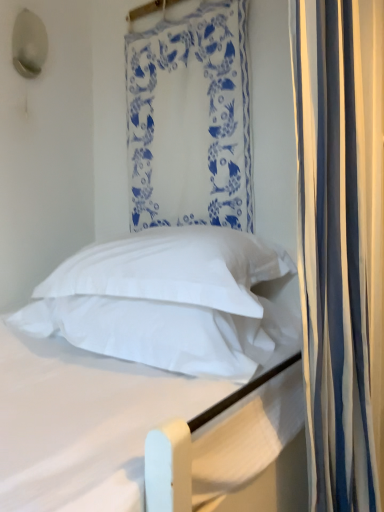
Measure the distance between point (150, 164) and camera.

Point (150, 164) is 4.96 feet away from camera.

In the scene shown: Measure the distance between point [133,255] and camera.

Point [133,255] is 3.72 feet from camera.

Image resolution: width=384 pixels, height=512 pixels. Find the location of `white soft pillow at center, which appears as the 1th pillow when ordered from the bottom`. white soft pillow at center, which appears as the 1th pillow when ordered from the bottom is located at coordinates (153, 333).

What are the coordinates of `white fabric at upper center, positioned as the 1th curtain in left-to-right order` in the screenshot? It's located at (190, 120).

From a real-world perspective, is white soft pillow at center, which is counted as the second pillow, starting from the bottom, located beneath white fabric at upper center, placed as the 1th curtain when sorted from back to front?

Correct, in the physical world, white soft pillow at center, which is counted as the second pillow, starting from the bottom, is lower than white fabric at upper center, placed as the 1th curtain when sorted from back to front.

Considering the relative sizes of white soft pillow at center, which is counted as the second pillow, starting from the bottom, and white fabric at upper center, placed as the 1th curtain when sorted from back to front, in the image provided, is white soft pillow at center, which is counted as the second pillow, starting from the bottom, smaller than white fabric at upper center, placed as the 1th curtain when sorted from back to front,?

Actually, white soft pillow at center, which is counted as the second pillow, starting from the bottom, might be larger than white fabric at upper center, placed as the 1th curtain when sorted from back to front.

From the image's perspective, is white soft pillow at center, which is counted as the second pillow, starting from the bottom, beneath white fabric at upper center, the 2th curtain in the front-to-back sequence?

Yes, from the image's perspective, white soft pillow at center, which is counted as the second pillow, starting from the bottom, is beneath white fabric at upper center, the 2th curtain in the front-to-back sequence.

How far apart are white striped curtain at right, which is counted as the 2th curtain, starting from the back, and white soft pillow at center, the 1th pillow in the top-to-bottom sequence?

15.44 inches.

Considering the relative sizes of white striped curtain at right, placed as the first curtain when sorted from front to back, and white soft pillow at center, the 1th pillow in the top-to-bottom sequence, in the image provided, is white striped curtain at right, placed as the first curtain when sorted from front to back, wider than white soft pillow at center, the 1th pillow in the top-to-bottom sequence,?

No, white striped curtain at right, placed as the first curtain when sorted from front to back, is not wider than white soft pillow at center, the 1th pillow in the top-to-bottom sequence.

Is white striped curtain at right, marked as the second curtain in a left-to-right arrangement, bigger or smaller than white soft pillow at center, the 1th pillow in the top-to-bottom sequence?

Considering their sizes, white striped curtain at right, marked as the second curtain in a left-to-right arrangement, takes up more space than white soft pillow at center, the 1th pillow in the top-to-bottom sequence.

Is white striped curtain at right, which is counted as the 2th curtain, starting from the back, aimed at white soft bed at center?

No.

Is white striped curtain at right, which is the first curtain in right-to-left order, bigger than white soft bed at center?

No, white striped curtain at right, which is the first curtain in right-to-left order, is not bigger than white soft bed at center.

Is white striped curtain at right, marked as the second curtain in a left-to-right arrangement, in contact with white soft bed at center?

white striped curtain at right, marked as the second curtain in a left-to-right arrangement, and white soft bed at center are clearly separated.

Between point (319, 316) and point (94, 419), which one is positioned in front?

The point (94, 419) is more forward.

Is point (289, 34) farther from camera compared to point (158, 310)?

No, it is in front of (158, 310).

Is white striped curtain at right, which is the first curtain in right-to-left order, looking in the opposite direction of white soft pillow at center, which is the second pillow in top-to-bottom order?

That's right, white striped curtain at right, which is the first curtain in right-to-left order, is facing away from white soft pillow at center, which is the second pillow in top-to-bottom order.

Considering the sizes of white striped curtain at right, which is the first curtain in right-to-left order, and white soft pillow at center, which is the second pillow in top-to-bottom order, in the image, is white striped curtain at right, which is the first curtain in right-to-left order, taller or shorter than white soft pillow at center, which is the second pillow in top-to-bottom order,?

In the image, white striped curtain at right, which is the first curtain in right-to-left order, appears to be taller than white soft pillow at center, which is the second pillow in top-to-bottom order.

From the image's perspective, relative to white soft pillow at center, which appears as the 1th pillow when ordered from the bottom, is white striped curtain at right, which is the first curtain in right-to-left order, above or below?

Clearly, from the image's perspective, white striped curtain at right, which is the first curtain in right-to-left order, is above white soft pillow at center, which appears as the 1th pillow when ordered from the bottom.

Based on the photo, measure the distance between white soft bed at center and white soft pillow at center, the 1th pillow in the top-to-bottom sequence.

The distance of white soft bed at center from white soft pillow at center, the 1th pillow in the top-to-bottom sequence, is 10.52 centimeters.

What's the angular difference between white soft bed at center and white soft pillow at center, which is counted as the second pillow, starting from the bottom,'s facing directions?

There is a 90-degree angle between the facing directions of white soft bed at center and white soft pillow at center, which is counted as the second pillow, starting from the bottom.

Is white soft bed at center facing towards white soft pillow at center, which is counted as the second pillow, starting from the bottom?

No, white soft bed at center is not aimed at white soft pillow at center, which is counted as the second pillow, starting from the bottom.

Which point is more distant from viewer, (x=236, y=477) or (x=199, y=251)?

Point (x=199, y=251)

Is white soft pillow at center, which is counted as the second pillow, starting from the bottom, to the right of white soft bed at center from the viewer's perspective?

Correct, you'll find white soft pillow at center, which is counted as the second pillow, starting from the bottom, to the right of white soft bed at center.

From a real-world perspective, which is physically below, white soft pillow at center, which is counted as the second pillow, starting from the bottom, or white soft bed at center?

white soft bed at center is physically lower.

Image resolution: width=384 pixels, height=512 pixels. Identify the location of bed located underneath the white soft pillow at center, the 1th pillow in the top-to-bottom sequence (from a real-world perspective). (129, 359).

Who is taller, white soft pillow at center, the 1th pillow in the top-to-bottom sequence, or white soft bed at center?

white soft bed at center.

Is white fabric at upper center, placed as the 1th curtain when sorted from back to front, at the back of white soft bed at center?

That's not correct — white soft bed at center is not looking away from white fabric at upper center, placed as the 1th curtain when sorted from back to front.

Can you confirm if white soft bed at center is wider than white fabric at upper center, the 2th curtain when ordered from right to left?

Yes, white soft bed at center is wider than white fabric at upper center, the 2th curtain when ordered from right to left.

From the image's perspective, which one is positioned lower, white soft bed at center or white fabric at upper center, the 2th curtain in the front-to-back sequence?

From the image's view, white soft bed at center is below.

Would you say white soft bed at center is to the left or to the right of white fabric at upper center, the 2th curtain in the front-to-back sequence, in the picture?

white soft bed at center is positioned on white fabric at upper center, the 2th curtain in the front-to-back sequence,'s left side.

There is a white fabric at upper center, the 2th curtain when ordered from right to left. Where is `the 1st pillow below it (from the image's perspective)`? the 1st pillow below it (from the image's perspective) is located at coordinates (174, 269).

Where is `curtain in front of the white soft pillow at center, the 1th pillow in the top-to-bottom sequence`? The image size is (384, 512). curtain in front of the white soft pillow at center, the 1th pillow in the top-to-bottom sequence is located at coordinates (341, 245).

When comparing their distances from white soft pillow at center, which is counted as the second pillow, starting from the bottom, does white striped curtain at right, marked as the second curtain in a left-to-right arrangement, or white soft pillow at center, which is the second pillow in top-to-bottom order, seem further?

The object further to white soft pillow at center, which is counted as the second pillow, starting from the bottom, is white striped curtain at right, marked as the second curtain in a left-to-right arrangement.

Estimate the real-world distances between objects in this image. Which object is closer to white soft pillow at center, which is counted as the second pillow, starting from the bottom, white soft pillow at center, which appears as the 1th pillow when ordered from the bottom, or white fabric at upper center, placed as the 1th curtain when sorted from back to front?

white soft pillow at center, which appears as the 1th pillow when ordered from the bottom.

From the image, which object appears to be farther from white striped curtain at right, which is counted as the 2th curtain, starting from the back, white fabric at upper center, placed as the 1th curtain when sorted from back to front, or white soft pillow at center, the 1th pillow in the top-to-bottom sequence?

white fabric at upper center, placed as the 1th curtain when sorted from back to front, lies further to white striped curtain at right, which is counted as the 2th curtain, starting from the back, than the other object.

Considering their positions, is white soft pillow at center, the 1th pillow in the top-to-bottom sequence, positioned closer to white soft bed at center than white striped curtain at right, placed as the first curtain when sorted from front to back?

white soft pillow at center, the 1th pillow in the top-to-bottom sequence.

Considering their positions, is white fabric at upper center, positioned as the 1th curtain in left-to-right order, positioned closer to white soft pillow at center, which is counted as the second pillow, starting from the bottom, than white soft pillow at center, which appears as the 1th pillow when ordered from the bottom?

white soft pillow at center, which appears as the 1th pillow when ordered from the bottom.

Looking at the image, which one is located closer to white fabric at upper center, the 2th curtain in the front-to-back sequence, white soft bed at center or white soft pillow at center, which is the second pillow in top-to-bottom order?

white soft bed at center lies closer to white fabric at upper center, the 2th curtain in the front-to-back sequence, than the other object.

In the scene shown: Estimate the real-world distances between objects in this image. Which object is further from white fabric at upper center, the 2th curtain when ordered from right to left, white striped curtain at right, placed as the first curtain when sorted from front to back, or white soft bed at center?

white striped curtain at right, placed as the first curtain when sorted from front to back, lies further to white fabric at upper center, the 2th curtain when ordered from right to left, than the other object.

Based on their spatial positions, is white fabric at upper center, the 2th curtain in the front-to-back sequence, or white soft pillow at center, which appears as the 1th pillow when ordered from the bottom, further from white soft bed at center?

Based on the image, white fabric at upper center, the 2th curtain in the front-to-back sequence, appears to be further to white soft bed at center.

Find the location of a particular element. The width and height of the screenshot is (384, 512). pillow between white soft pillow at center, which appears as the 1th pillow when ordered from the bottom, and white striped curtain at right, marked as the second curtain in a left-to-right arrangement, in the horizontal direction is located at coordinates (174, 269).

The image size is (384, 512). Find the location of `curtain between white fabric at upper center, placed as the 1th curtain when sorted from back to front, and white soft pillow at center, which appears as the 1th pillow when ordered from the bottom, from top to bottom`. curtain between white fabric at upper center, placed as the 1th curtain when sorted from back to front, and white soft pillow at center, which appears as the 1th pillow when ordered from the bottom, from top to bottom is located at coordinates (341, 245).

The image size is (384, 512). Identify the location of pillow between white soft bed at center and white soft pillow at center, which appears as the 1th pillow when ordered from the bottom, in the front-back direction. (174, 269).

Locate an element on the screen. pillow between white fabric at upper center, placed as the 1th curtain when sorted from back to front, and white soft pillow at center, which is the second pillow in top-to-bottom order, from top to bottom is located at coordinates (174, 269).